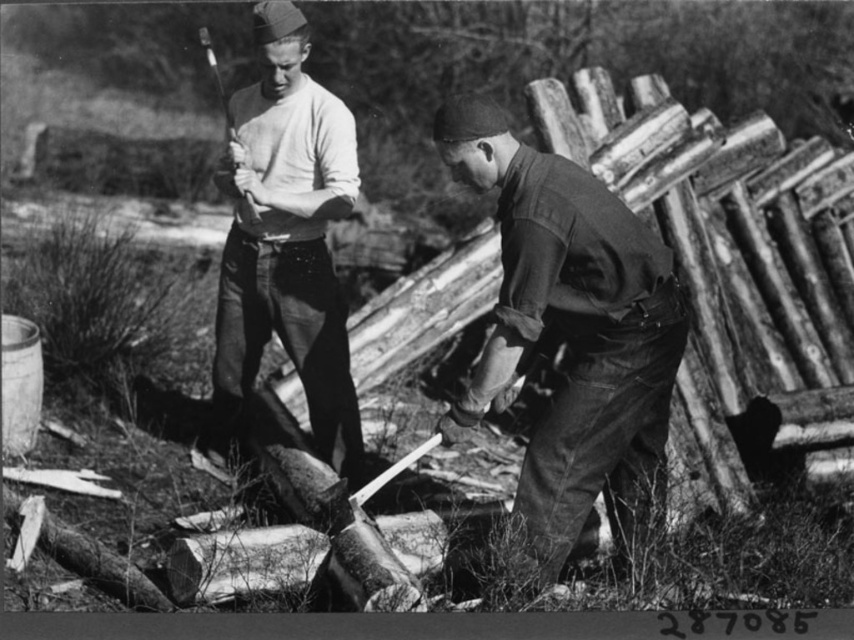
You are a photographer analyzing this black and white photo. You notice the dark green uniform at center and the smooth wood ax at upper center. Which object occupies a smaller vertical space in the image?

The dark green uniform at center has a lesser height compared to the smooth wood ax at upper center, so the dark green uniform at center occupies a smaller vertical space.

You are standing in the scene and want to pick up an object located at point (x=240, y=216). Is this object within your immediate reach without moving your feet?

The distance of point (x=240, y=216) from viewer is 17.31 feet, so the object is too far to reach without moving your feet since it is over 15 feet away.